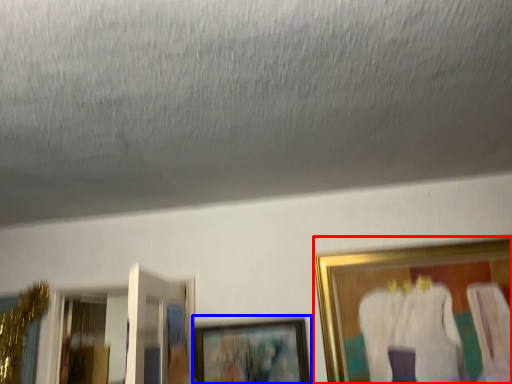
Question: Which object appears closest to the camera in this image, picture frame (highlighted by a red box) or picture frame (highlighted by a blue box)?

Choices:
 (A) picture frame
 (B) picture frame

Answer: (A)